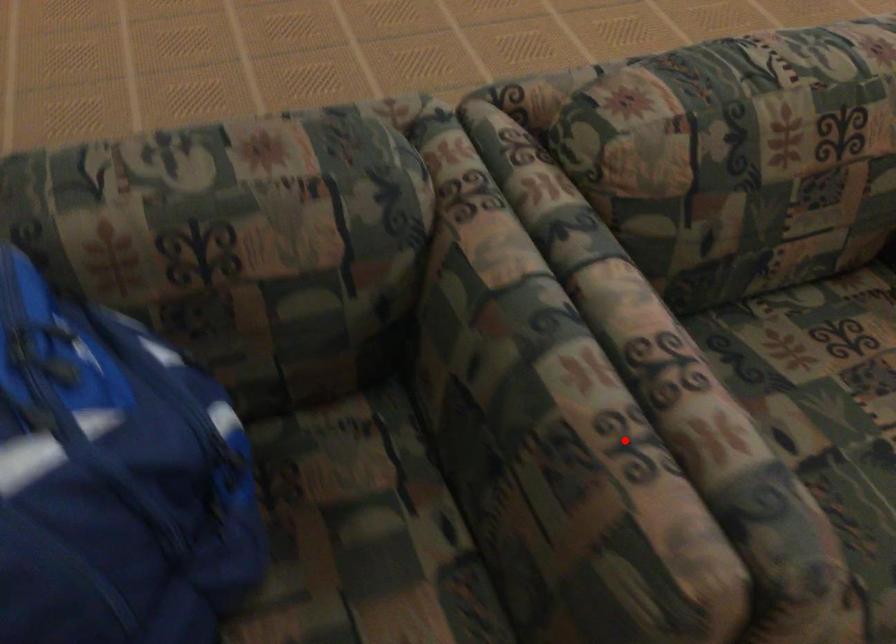
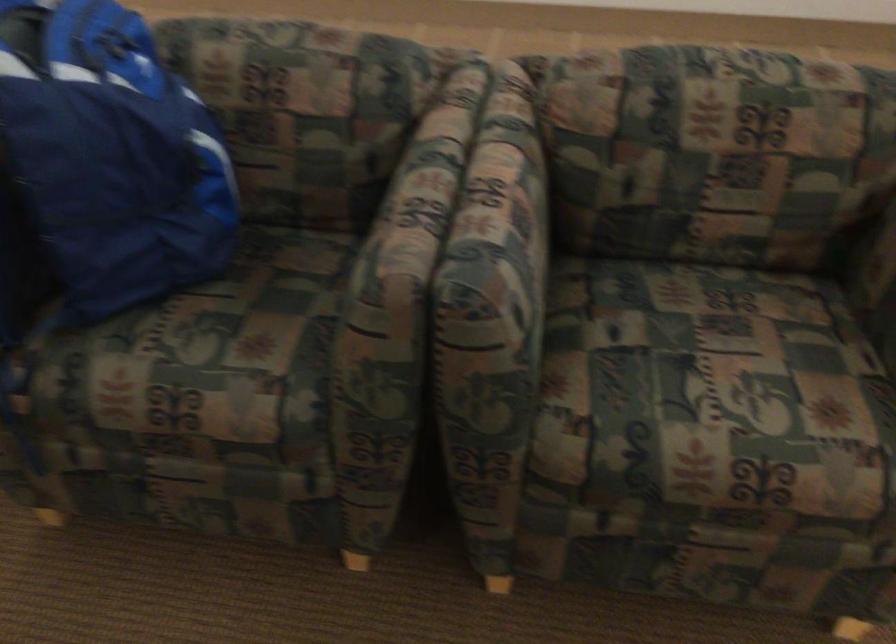
In the second image, find the point that corresponds to the highlighted location in the first image.

(412, 207)